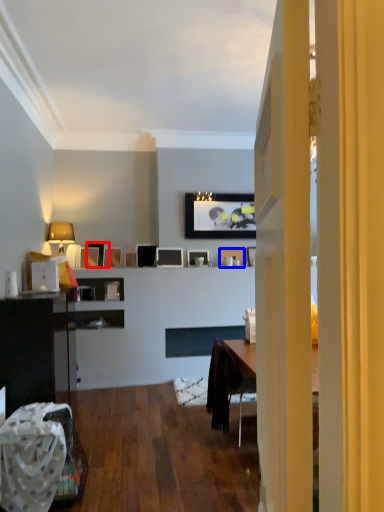
Question: Among these objects, which one is farthest to the camera, picture frame (highlighted by a red box) or picture frame (highlighted by a blue box)?

Choices:
 (A) picture frame
 (B) picture frame

Answer: (B)